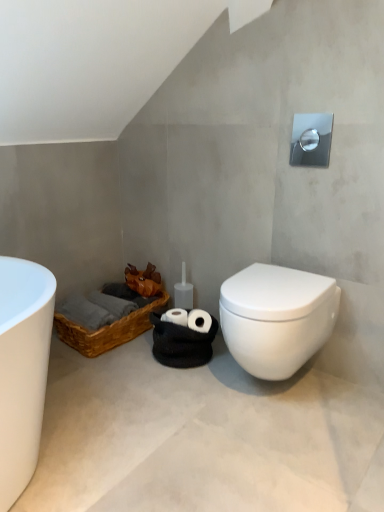
What do you see at coordinates (276, 318) in the screenshot? I see `white glossy toilet at lower right` at bounding box center [276, 318].

In the scene shown: What is the approximate width of white glossy toilet at lower right?

The width of white glossy toilet at lower right is 19.24 inches.

What are the coordinates of `brown woven basket at lower left` in the screenshot? It's located at (107, 330).

This screenshot has height=512, width=384. Identify the location of white glossy toilet at lower right. (276, 318).

Is white matte concrete at lower center thinner than white glossy toilet at lower right?

In fact, white matte concrete at lower center might be wider than white glossy toilet at lower right.

Which of these two, white matte concrete at lower center or white glossy toilet at lower right, is bigger?

With larger size is white matte concrete at lower center.

Does white glossy toilet at lower right have a lesser height compared to white matte concrete at lower center?

In fact, white glossy toilet at lower right may be taller than white matte concrete at lower center.

From the image's perspective, which one is positioned lower, white glossy toilet at lower right or white matte concrete at lower center?

white matte concrete at lower center is shown below in the image.

Is white glossy toilet at lower right oriented towards white matte concrete at lower center?

No, white glossy toilet at lower right is not facing towards white matte concrete at lower center.

Which of these two, white glossy toilet at lower right or white matte concrete at lower center, is thinner?

Thinner between the two is white glossy toilet at lower right.

Is brown woven basket at lower left aimed at white glossy toilet at lower right?

No, brown woven basket at lower left is not turned towards white glossy toilet at lower right.

Consider the image. Visually, is brown woven basket at lower left positioned to the left or to the right of white glossy toilet at lower right?

Clearly, brown woven basket at lower left is on the left of white glossy toilet at lower right in the image.

Is brown woven basket at lower left behind white glossy toilet at lower right?

That is True.

From the image's perspective, which is below, white glossy toilet at lower right or brown woven basket at lower left?

brown woven basket at lower left is shown below in the image.

Can we say white glossy toilet at lower right lies outside brown woven basket at lower left?

white glossy toilet at lower right lies outside brown woven basket at lower left's area.

Is white glossy toilet at lower right shorter than brown woven basket at lower left?

In fact, white glossy toilet at lower right may be taller than brown woven basket at lower left.

Find the location of a particular element. This screenshot has width=384, height=512. concrete located below the brown woven basket at lower left (from the image's perspective) is located at coordinates (203, 437).

What's the angular difference between white matte concrete at lower center and brown woven basket at lower left's facing directions?

The angular difference between white matte concrete at lower center and brown woven basket at lower left is 88 degrees.

Which object is wider, white matte concrete at lower center or brown woven basket at lower left?

white matte concrete at lower center is wider.

Does point (365, 397) come in front of point (64, 327)?

Yes, it is in front of point (64, 327).

Which object is thinner, brown woven basket at lower left or white matte concrete at lower center?

With smaller width is brown woven basket at lower left.

Who is taller, brown woven basket at lower left or white matte concrete at lower center?

brown woven basket at lower left is taller.

Considering the positions of objects brown woven basket at lower left and white matte concrete at lower center in the image provided, who is more to the left, brown woven basket at lower left or white matte concrete at lower center?

Positioned to the left is brown woven basket at lower left.

How different are the orientations of brown woven basket at lower left and white matte concrete at lower center in degrees?

The angle between the facing direction of brown woven basket at lower left and the facing direction of white matte concrete at lower center is 88 degrees.

In order to click on concrete in front of the white glossy toilet at lower right in this screenshot , I will do `click(203, 437)`.

You are a GUI agent. You are given a task and a screenshot of the screen. Output one action in this format:
    pyautogui.click(x=<x>, y=<y>)
    Task: Click on the concrete below the white glossy toilet at lower right (from a real-world perspective)
    Image resolution: width=384 pixels, height=512 pixels.
    Given the screenshot: What is the action you would take?
    pyautogui.click(x=203, y=437)

From the picture: From the image, which object appears to be farther from brown woven basket at lower left, white glossy toilet at lower right or white matte concrete at lower center?

white glossy toilet at lower right is positioned further to the anchor brown woven basket at lower left.

When comparing their distances from white matte concrete at lower center, does brown woven basket at lower left or white glossy toilet at lower right seem further?

Among the two, brown woven basket at lower left is located further to white matte concrete at lower center.

When comparing their distances from white matte concrete at lower center, does white glossy toilet at lower right or brown woven basket at lower left seem further?

brown woven basket at lower left.

Considering their positions, is white matte concrete at lower center positioned closer to brown woven basket at lower left than white glossy toilet at lower right?

Based on the image, white matte concrete at lower center appears to be nearer to brown woven basket at lower left.

Looking at the image, which one is located further to white glossy toilet at lower right, brown woven basket at lower left or white matte concrete at lower center?

brown woven basket at lower left lies further to white glossy toilet at lower right than the other object.

Looking at the image, which one is located further to white glossy toilet at lower right, white matte concrete at lower center or brown woven basket at lower left?

brown woven basket at lower left is positioned further to the anchor white glossy toilet at lower right.

What are the coordinates of `toilet between white matte concrete at lower center and brown woven basket at lower left from front to back` in the screenshot? It's located at (276, 318).